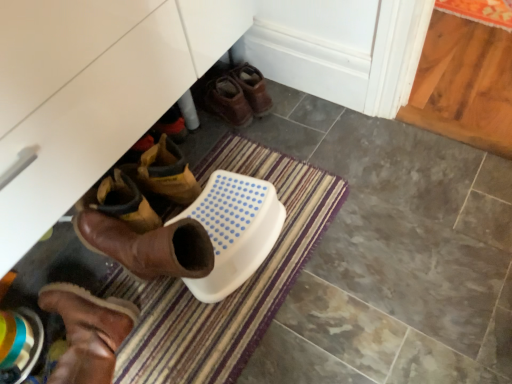
You are a GUI agent. You are given a task and a screenshot of the screen. Output one action in this format:
    pyautogui.click(x=<x>, y=<y>)
    Task: Click on the free spot to the right of striped carpet at lower center
    Image resolution: width=512 pixels, height=384 pixels.
    Given the screenshot: What is the action you would take?
    pyautogui.click(x=389, y=244)